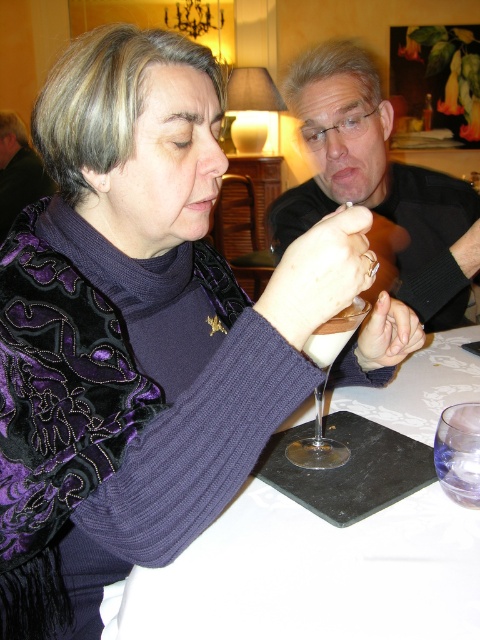
Question: Considering the relative positions of matte black shirt at upper right and transparent glass at center in the image provided, where is matte black shirt at upper right located with respect to transparent glass at center?

Choices:
 (A) right
 (B) left

Answer: (A)

Question: Which is farther from the transparent glass at lower right?

Choices:
 (A) matte black sweater at upper left
 (B) white matte table at center
 (C) matte black shirt at upper right

Answer: (A)

Question: Can you confirm if transparent glass at center is thinner than matte black sweater at upper left?

Choices:
 (A) yes
 (B) no

Answer: (A)

Question: Is transparent glass at center bigger than matte black sweater at upper left?

Choices:
 (A) yes
 (B) no

Answer: (B)

Question: Which point is closer to the camera taking this photo?

Choices:
 (A) (358, 140)
 (B) (463, 481)
 (C) (459, 595)
 (D) (312, 339)

Answer: (C)

Question: Estimate the real-world distances between objects in this image. Which object is closer to the transparent glass at lower right?

Choices:
 (A) transparent glass at center
 (B) white matte table at center
 (C) matte black sweater at upper left

Answer: (A)